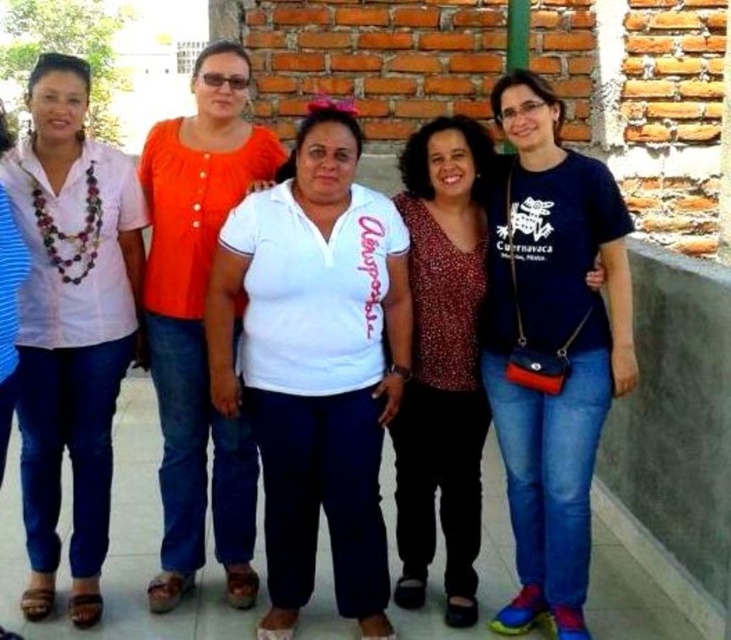
Question: Does white matte shirt at center appear on the left side of blue cotton t-shirt at center?

Choices:
 (A) no
 (B) yes

Answer: (B)

Question: Can you confirm if matte white blouse at left is wider than orange matte blouse at center?

Choices:
 (A) no
 (B) yes

Answer: (A)

Question: Observing the image, what is the correct spatial positioning of blue cotton t-shirt at center in reference to matte white blouse at left?

Choices:
 (A) above
 (B) below

Answer: (B)

Question: Which object appears farthest from the camera in this image?

Choices:
 (A) matte white blouse at left
 (B) white matte shirt at center
 (C) orange matte blouse at center

Answer: (C)

Question: Which of the following is the farthest from the observer?

Choices:
 (A) orange matte blouse at center
 (B) dark red textured blouse at center
 (C) blue cotton t-shirt at center
 (D) matte white blouse at left

Answer: (A)

Question: Among these objects, which one is farthest from the camera?

Choices:
 (A) white matte shirt at center
 (B) matte white blouse at left
 (C) dark red textured blouse at center
 (D) blue cotton t-shirt at center

Answer: (C)